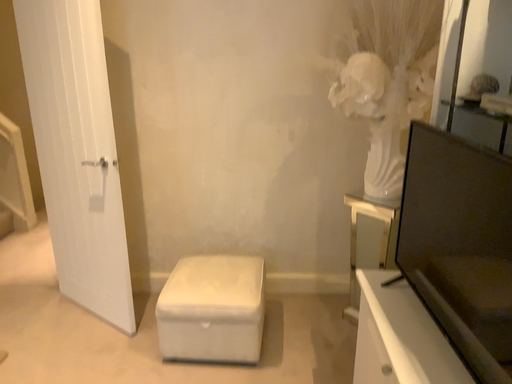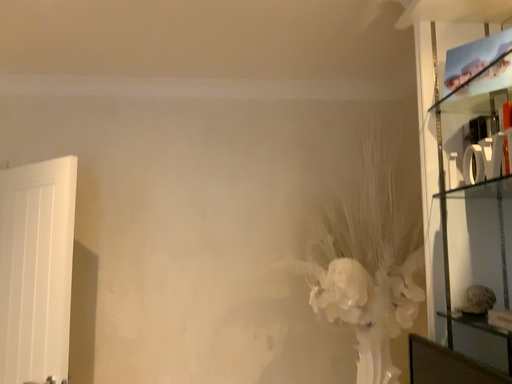
Question: How did the camera likely rotate when shooting the video?

Choices:
 (A) rotated upward
 (B) rotated downward

Answer: (A)